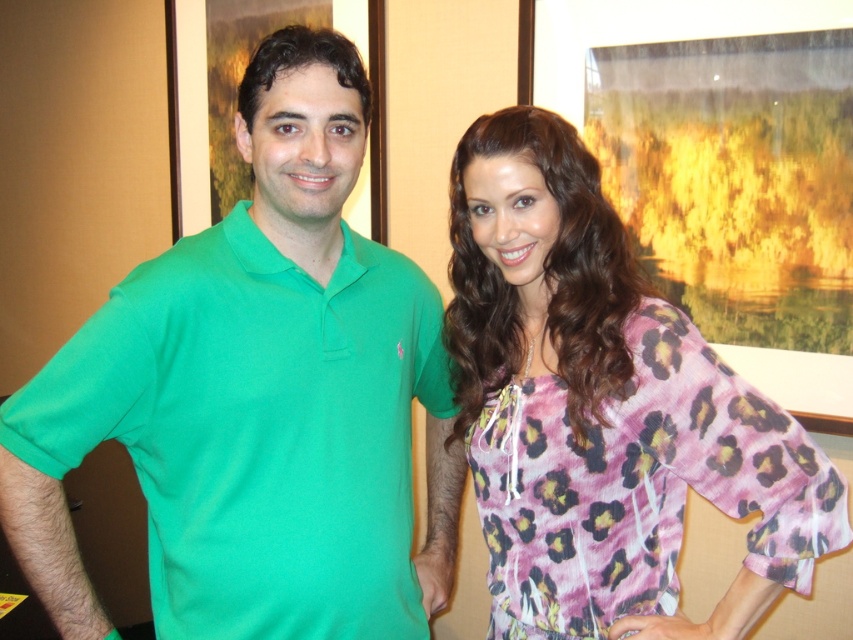
Question: Is the position of green polo shirt at left less distant than that of pink leopard print blouse at right?

Choices:
 (A) yes
 (B) no

Answer: (B)

Question: Which of the following is the farthest from the observer?

Choices:
 (A) (606, 394)
 (B) (79, 448)

Answer: (A)

Question: Is green polo shirt at left further to the viewer compared to pink leopard print blouse at right?

Choices:
 (A) yes
 (B) no

Answer: (A)

Question: Can you confirm if green polo shirt at left is positioned to the right of pink leopard print blouse at right?

Choices:
 (A) no
 (B) yes

Answer: (A)

Question: Which point is farther to the camera?

Choices:
 (A) pink leopard print blouse at right
 (B) green polo shirt at left

Answer: (B)